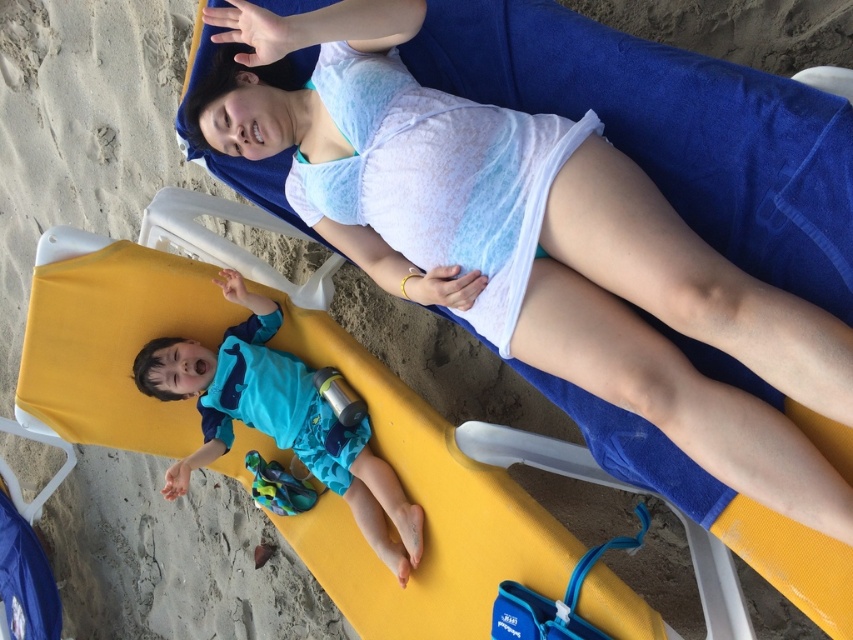
Question: Among these points, which one is farthest from the camera?

Choices:
 (A) (405, 572)
 (B) (665, 280)

Answer: (A)

Question: Which object appears closest to the camera in this image?

Choices:
 (A) blue fabric swimsuit at lower left
 (B) blue fabric swimsuit at center

Answer: (A)

Question: Where is blue fabric swimsuit at lower left located in relation to blue fabric swimsuit at center in the image?

Choices:
 (A) right
 (B) left

Answer: (A)

Question: Where is blue fabric swimsuit at lower left located in relation to blue fabric swimsuit at center in the image?

Choices:
 (A) left
 (B) right

Answer: (B)

Question: Is blue fabric swimsuit at lower left below blue fabric swimsuit at center?

Choices:
 (A) yes
 (B) no

Answer: (B)